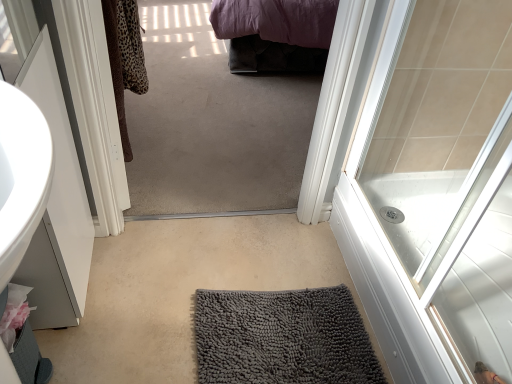
At what (x,y) coordinates should I click in order to perform the action: click on vacant area on top of gray textured bath mat at center (from a real-world perspective). Please return your answer as a coordinate pair (x, y). This screenshot has width=512, height=384. Looking at the image, I should click on (206, 292).